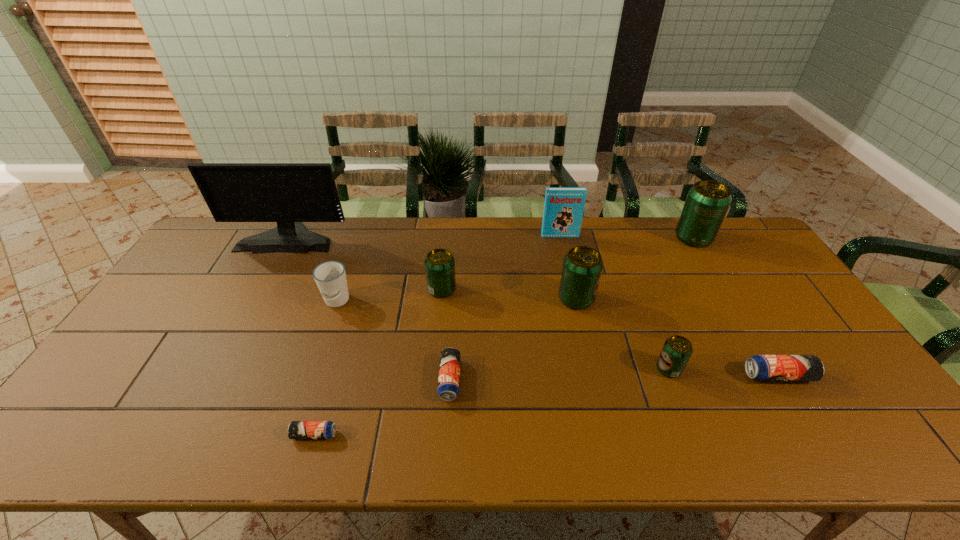
This screenshot has width=960, height=540. In order to click on beer can that stands as the second closest to the nearest blue beer can in this screenshot , I will do `click(439, 263)`.

Find the location of a particular element. Image resolution: width=960 pixels, height=540 pixels. beer can that is the fifth closest one to the third shortest object is located at coordinates (439, 263).

The image size is (960, 540). Identify the location of the second closest green beer can relative to the third shortest beer can. (582, 267).

Point out which green beer can is positioned as the nearest to the fifth beer can from left to right. Please provide its 2D coordinates. Your answer should be formatted as a tuple, i.e. [(x, y)], where the tuple contains the x and y coordinates of a point satisfying the conditions above.

[(582, 267)]

Select which blue beer can appears as the third closest to the monitor. Please provide its 2D coordinates. Your answer should be formatted as a tuple, i.e. [(x, y)], where the tuple contains the x and y coordinates of a point satisfying the conditions above.

[(759, 367)]

This screenshot has width=960, height=540. Identify the location of blue beer can that is the second closest one to the nearest blue beer can. (759, 367).

Locate an element on the screen. Image resolution: width=960 pixels, height=540 pixels. free space that satisfies the following two spatial constraints: 1. on the back side of the leftmost beer can; 2. on the right side of the third tallest beer can is located at coordinates (357, 289).

At what (x,y) coordinates should I click in order to perform the action: click on free space that satisfies the following two spatial constraints: 1. with a handle on the side of the second blue beer can from right to left; 2. on the left side of the cup. Please return your answer as a coordinate pair (x, y). Image resolution: width=960 pixels, height=540 pixels. Looking at the image, I should click on [x=310, y=380].

This screenshot has width=960, height=540. I want to click on free location that satisfies the following two spatial constraints: 1. on the screen side of the tallest object; 2. on the right side of the leftmost beer can, so click(x=182, y=435).

What are the coordinates of `vacant region that satisfies the following two spatial constraints: 1. with a handle on the side of the white cup; 2. on the left side of the second shortest object` in the screenshot? It's located at (310, 380).